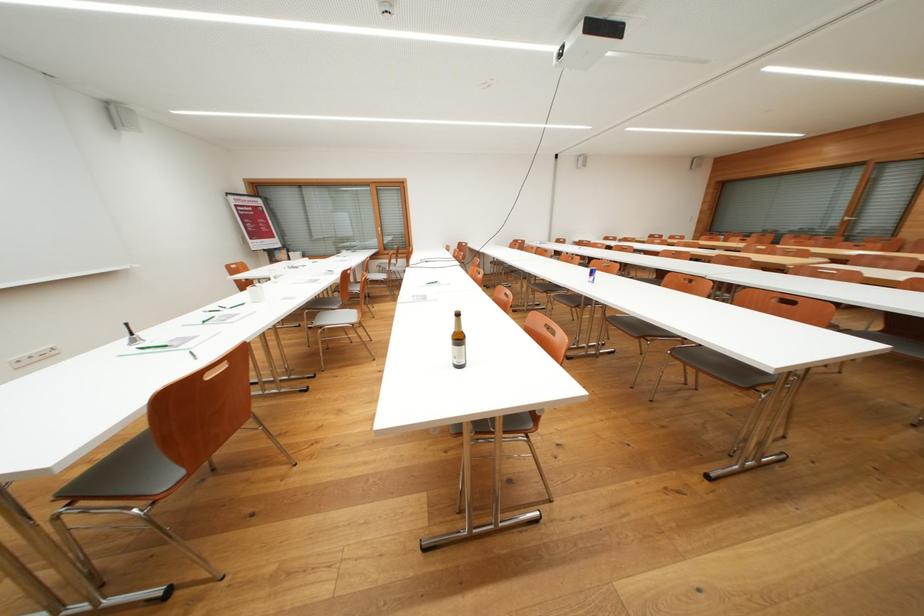
Locate an element on the screen. window handle is located at coordinates (848, 217).